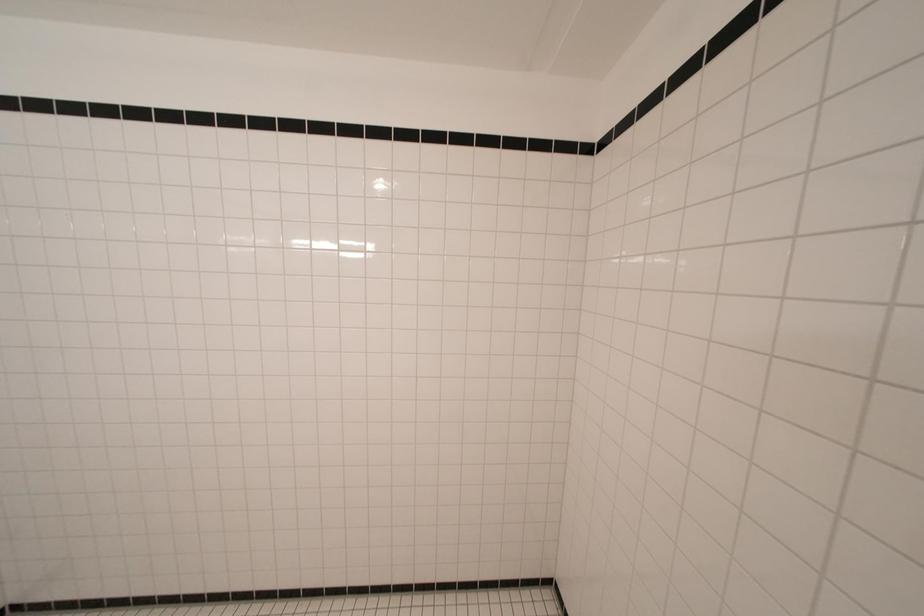
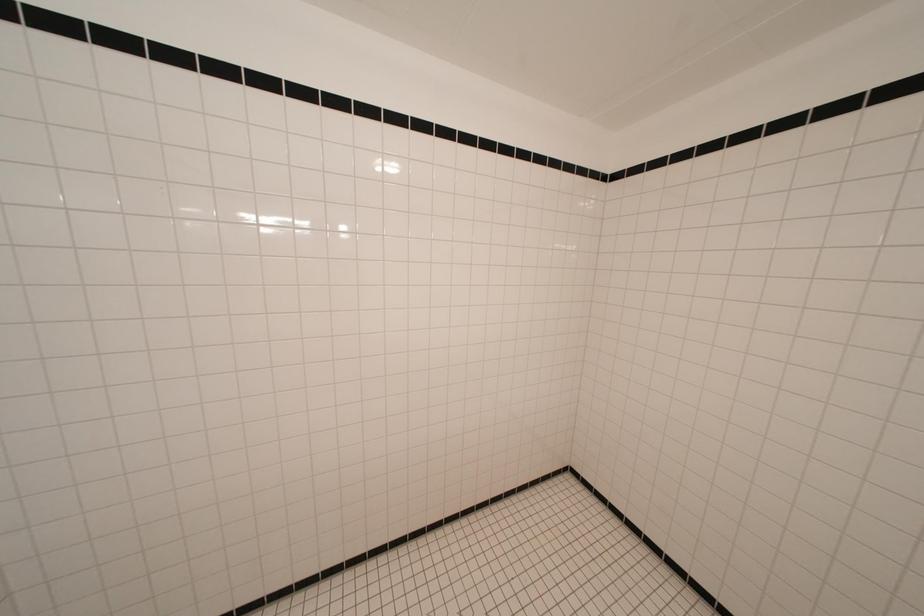
Question: What movement of the cameraman would produce the second image?

Choices:
 (A) Left
 (B) Right
 (C) Forward
 (D) Backward

Answer: (A)